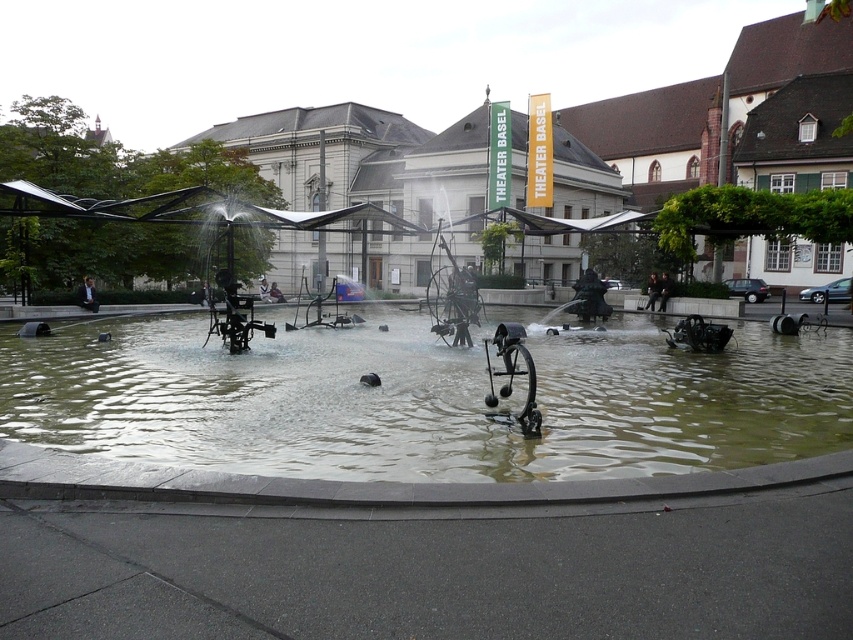
Question: Which of the following is the farthest from the observer?

Choices:
 (A) (651, 308)
 (B) (259, 292)
 (C) (209, 445)

Answer: (B)

Question: Is light blue denim jacket at center bigger than dark blue fabric jacket at center?

Choices:
 (A) yes
 (B) no

Answer: (B)

Question: Does light blue denim jacket at center appear over dark blue fabric jacket at center?

Choices:
 (A) no
 (B) yes

Answer: (A)

Question: Is dark gray metal sculpture at center smaller than dark blue fabric jacket at center?

Choices:
 (A) yes
 (B) no

Answer: (A)

Question: Which point appears farthest from the camera in this image?

Choices:
 (A) (90, 296)
 (B) (656, 275)

Answer: (B)

Question: Considering the real-world distances, which object is farthest from the dark blue jeans at center?

Choices:
 (A) light brown leather jacket at lower left
 (B) dark gray metal sculpture at center
 (C) light blue denim jacket at center

Answer: (C)